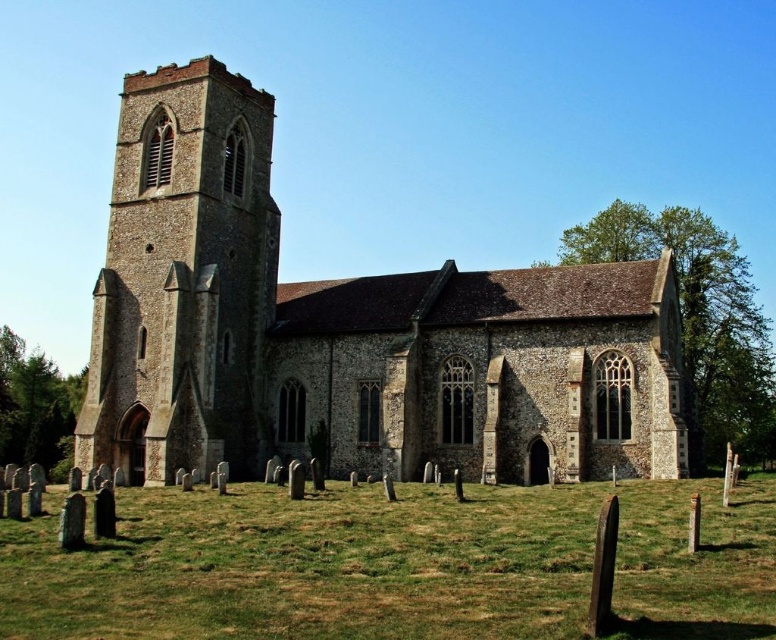
Question: Is the position of stone church at center more distant than that of green grass at lower center?

Choices:
 (A) yes
 (B) no

Answer: (A)

Question: Which object is closer to the camera taking this photo?

Choices:
 (A) stone tower at left
 (B) stone church at center

Answer: (B)

Question: Observing the image, what is the correct spatial positioning of stone church at center in reference to green grass at lower center?

Choices:
 (A) below
 (B) above

Answer: (B)

Question: Does green grass at lower center have a larger size compared to stone tower at left?

Choices:
 (A) yes
 (B) no

Answer: (B)

Question: Among these points, which one is farthest from the camera?

Choices:
 (A) (766, 541)
 (B) (283, 380)

Answer: (B)

Question: Which of the following is the farthest from the observer?

Choices:
 (A) (603, 275)
 (B) (411, 513)
 (C) (165, 408)

Answer: (A)